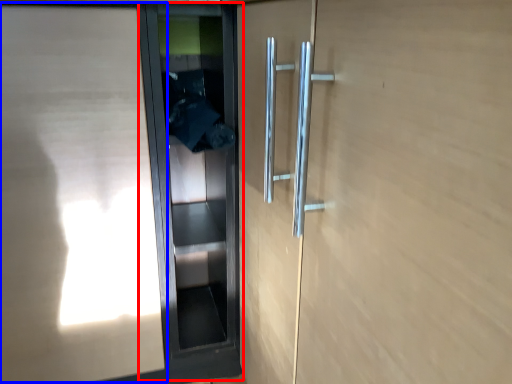
Question: Which point is further to the camera, elevator door (highlighted by a red box) or elevator door (highlighted by a blue box)?

Choices:
 (A) elevator door
 (B) elevator door

Answer: (A)